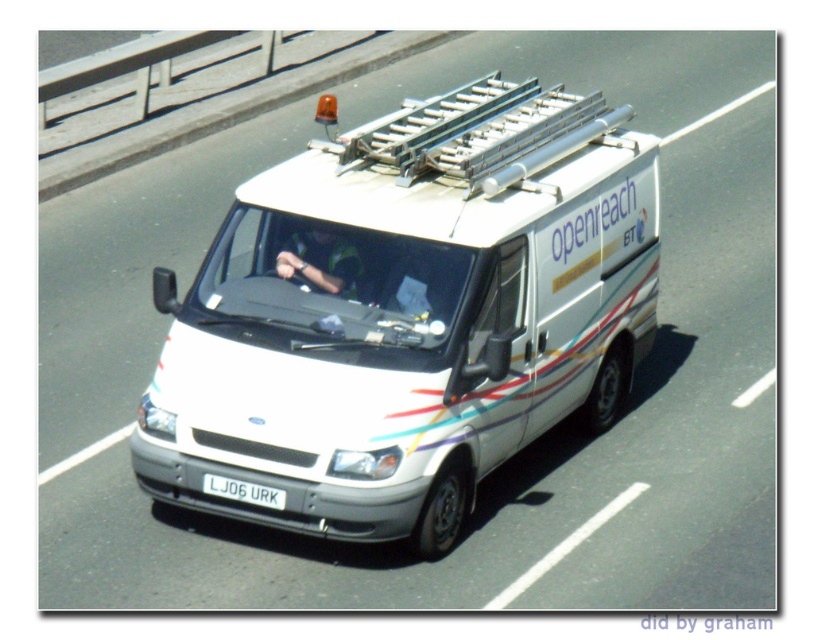
You are a delivery driver who needs to park your van in a spot that requires the license plate to be visible from the front. Given the distance between the white matte van at center and the white plastic license plate at center, will the license plate be visible when parked?

The distance between the white matte van at center and the white plastic license plate at center is 4.62 feet, which means the license plate is attached to the van and positioned in a way that it should remain visible from the front when parked, as the distance indicates proper placement.

You are a traffic officer standing at the side of the road. You observe a white matte van at center driving on a multi lane road. According to traffic regulations, the minimum safe distance between a moving vehicle and a stationary officer should be at least 10 meters. Can you safely stand there without violating the safety guidelines?

The distance between the white matte van at center and the camera is 9.14 meters, which is less than the required 10 meters. Therefore, standing there would violate the safety guidelines.

Based on the photo, you are a pedestrian standing at the side of the road. You see a white matte van at center and a green fabric shirt at center. Which object is closer to you?

The white matte van at center is closer to you since it is only 75.86 centimeters away from the green fabric shirt at center, which is also at the same central position as you.